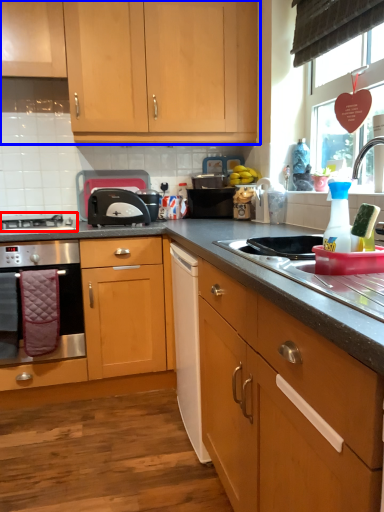
Question: Among these objects, which one is nearest to the camera, gas stove (highlighted by a red box) or cabinetry (highlighted by a blue box)?

Choices:
 (A) gas stove
 (B) cabinetry

Answer: (B)